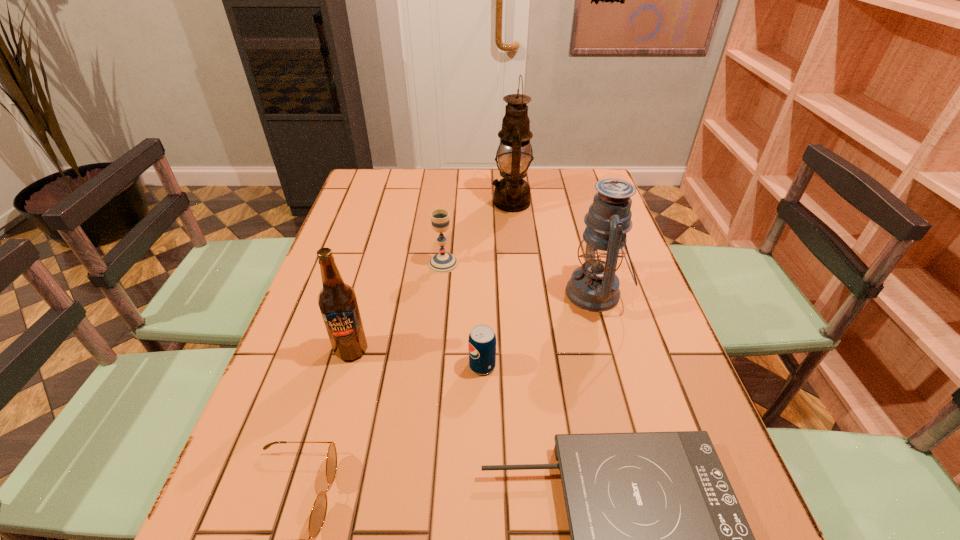
The width and height of the screenshot is (960, 540). Find the location of `vacant area between the beer bottle and the lantern`. vacant area between the beer bottle and the lantern is located at coordinates (473, 322).

Locate an element on the screen. The image size is (960, 540). object identified as the fifth closest to the sunglasses is located at coordinates (594, 286).

You are a GUI agent. You are given a task and a screenshot of the screen. Output one action in this format:
    pyautogui.click(x=<x>, y=<y>)
    Task: Click on the object that stands as the second closest to the pop
    The image size is (960, 540).
    Given the screenshot: What is the action you would take?
    pyautogui.click(x=594, y=286)